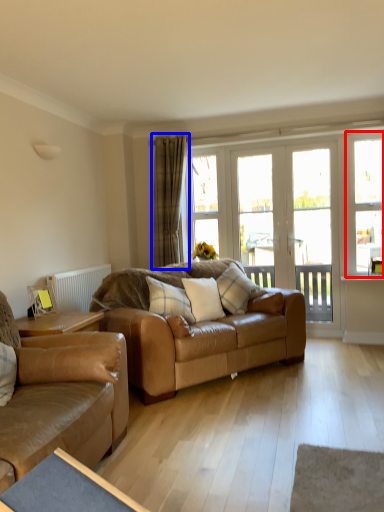
Question: Which point is further to the camera, window (highlighted by a red box) or curtain (highlighted by a blue box)?

Choices:
 (A) window
 (B) curtain

Answer: (B)